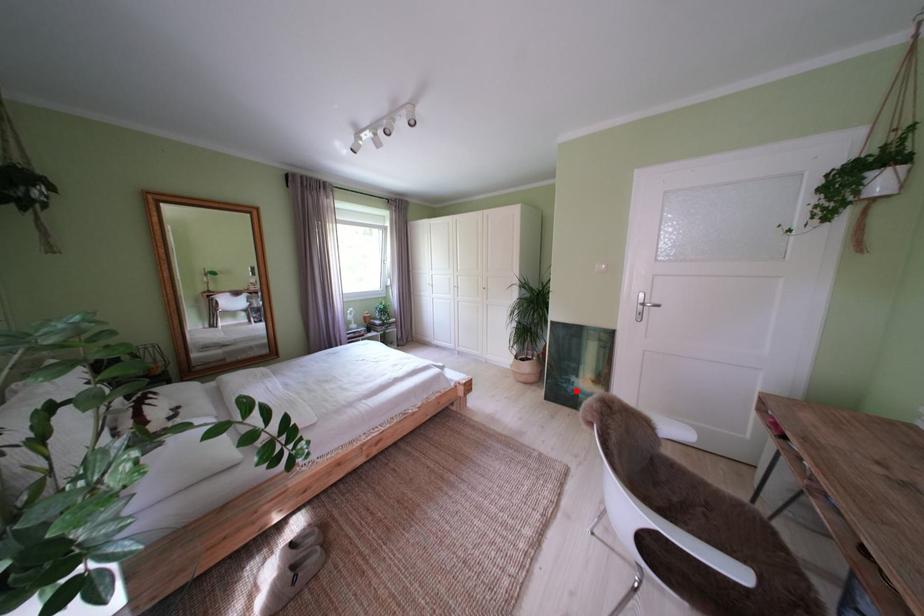
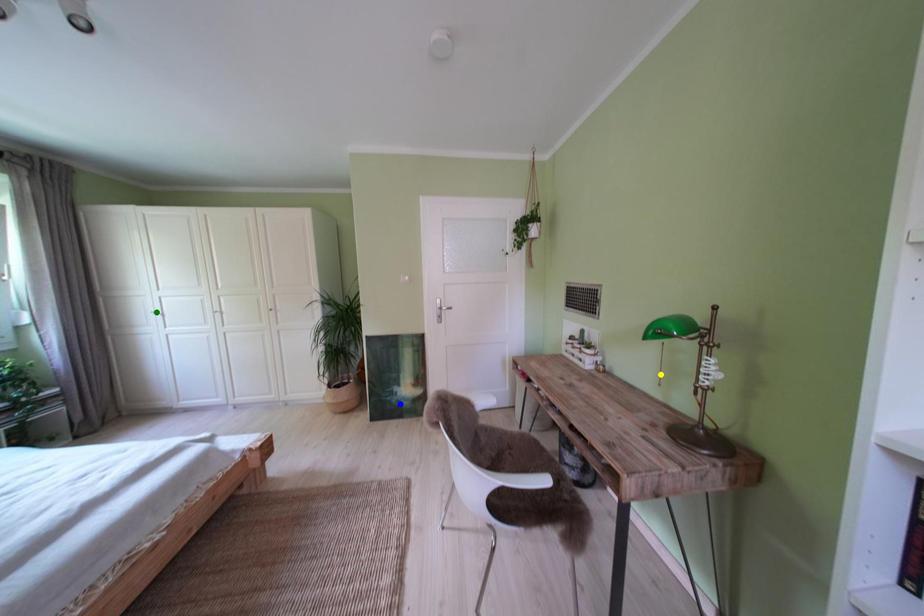
Question: I am providing you with two images of the same scene from different viewpoints. A red point is marked on the first image. You are given multiple points on the second image. Which point in image 2 represents the same 3d spot as the red point in image 1?

Choices:
 (A) blue point
 (B) green point
 (C) yellow point

Answer: (A)